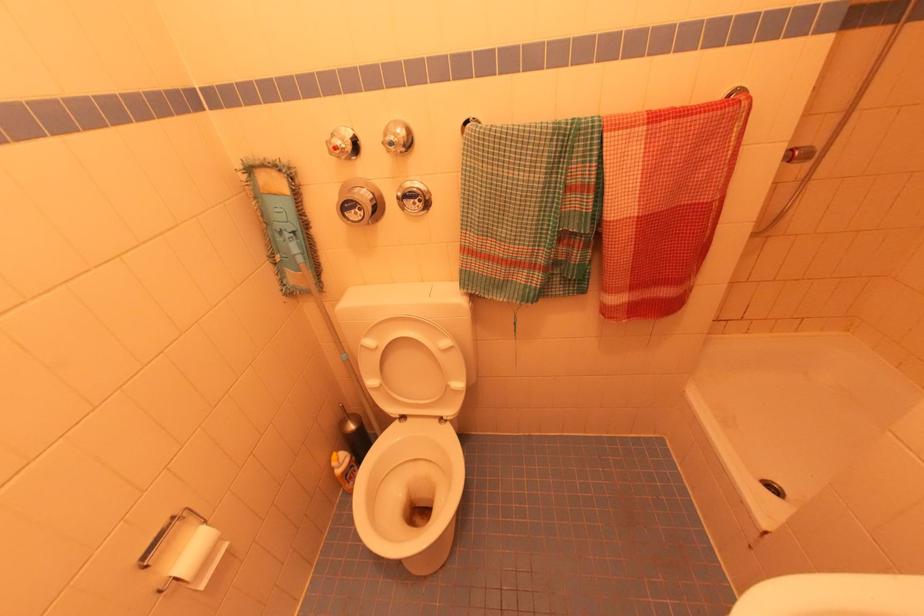
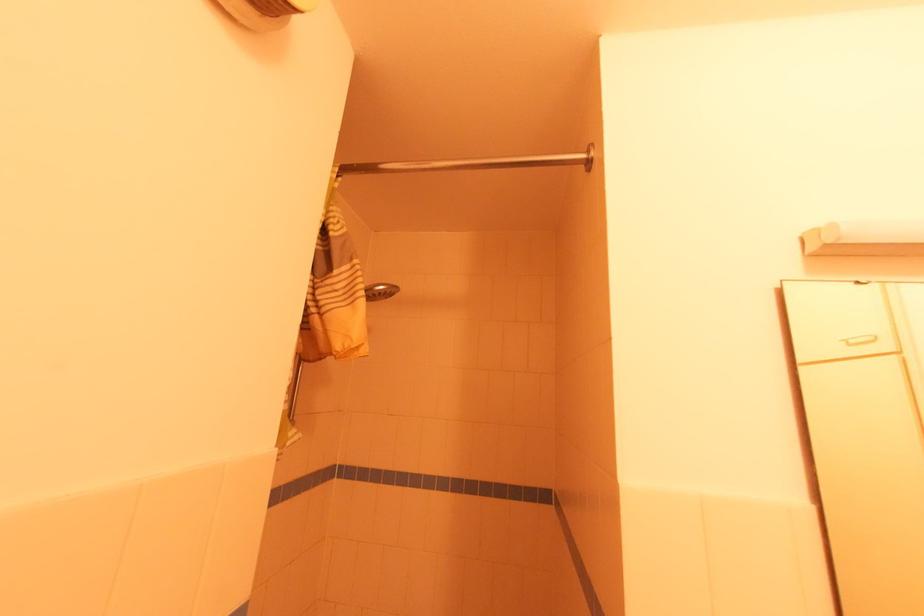
The first image is from the beginning of the video and the second image is from the end. How did the camera likely rotate when shooting the video?

The camera's rotation is toward right-up.